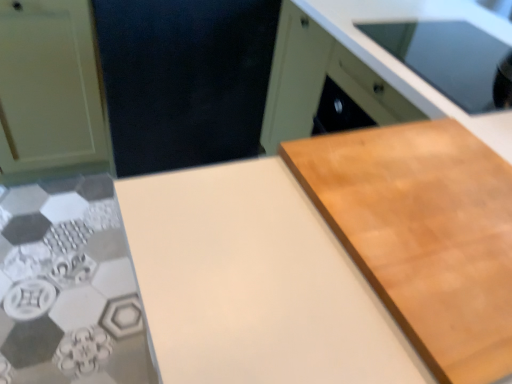
Question: From a real-world perspective, is light brown wood cutting board at right physically above light wood cabinet at upper right, which is counted as the second cabinetry, starting from the left?

Choices:
 (A) yes
 (B) no

Answer: (A)

Question: Is there a large distance between light brown wood cutting board at right and light wood cabinet at upper right, which is the 1th cabinetry in right-to-left order?

Choices:
 (A) no
 (B) yes

Answer: (A)

Question: From a real-world perspective, is light brown wood cutting board at right located beneath light wood cabinet at upper right, which is counted as the second cabinetry, starting from the left?

Choices:
 (A) no
 (B) yes

Answer: (A)

Question: Considering the relative positions of light brown wood cutting board at right and light wood cabinet at upper right, which is counted as the second cabinetry, starting from the left, in the image provided, is light brown wood cutting board at right to the left of light wood cabinet at upper right, which is counted as the second cabinetry, starting from the left, from the viewer's perspective?

Choices:
 (A) yes
 (B) no

Answer: (A)

Question: Is light wood cabinet at upper right, which is the 1th cabinetry in right-to-left order, located within light brown wood cutting board at right?

Choices:
 (A) no
 (B) yes

Answer: (A)

Question: Is light brown wood cutting board at right taller than light wood cabinet at upper right, which is counted as the second cabinetry, starting from the left?

Choices:
 (A) yes
 (B) no

Answer: (B)

Question: From the image's perspective, is light brown wood cutting board at right beneath white matte countertop at center?

Choices:
 (A) yes
 (B) no

Answer: (B)

Question: Can white matte countertop at center be found inside light brown wood cutting board at right?

Choices:
 (A) no
 (B) yes

Answer: (A)

Question: Does light brown wood cutting board at right have a lesser width compared to white matte countertop at center?

Choices:
 (A) yes
 (B) no

Answer: (A)

Question: Does light brown wood cutting board at right have a greater width compared to white matte countertop at center?

Choices:
 (A) yes
 (B) no

Answer: (B)

Question: Is light brown wood cutting board at right placed right next to white matte countertop at center?

Choices:
 (A) yes
 (B) no

Answer: (B)

Question: Does light brown wood cutting board at right appear on the left side of white matte countertop at center?

Choices:
 (A) yes
 (B) no

Answer: (B)

Question: Can you confirm if matte white cabinet at left, the second cabinetry positioned from the right, is taller than light brown wood cutting board at right?

Choices:
 (A) yes
 (B) no

Answer: (A)